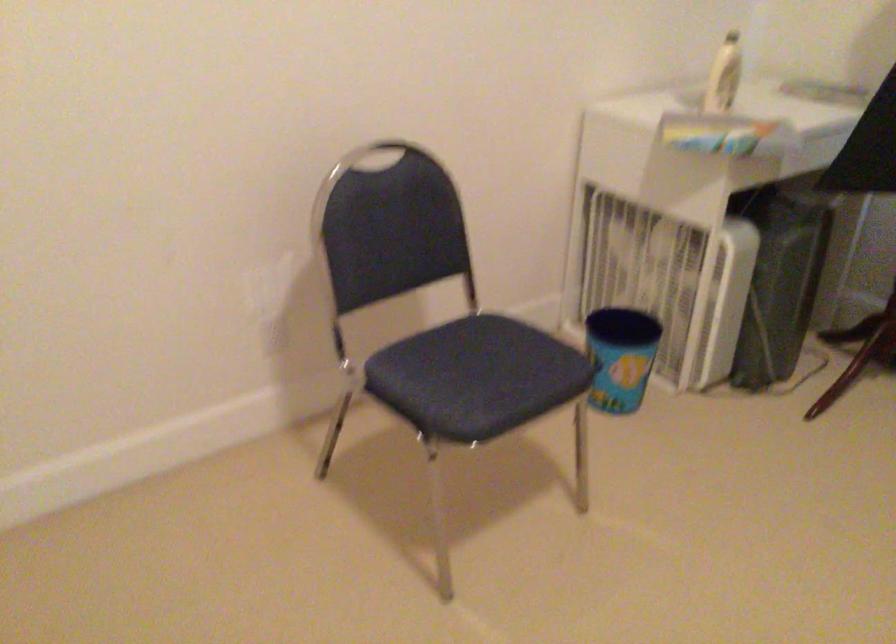
Where would you pull the chair back handle? Please return your answer as a coordinate pair (x, y).

(377, 156)